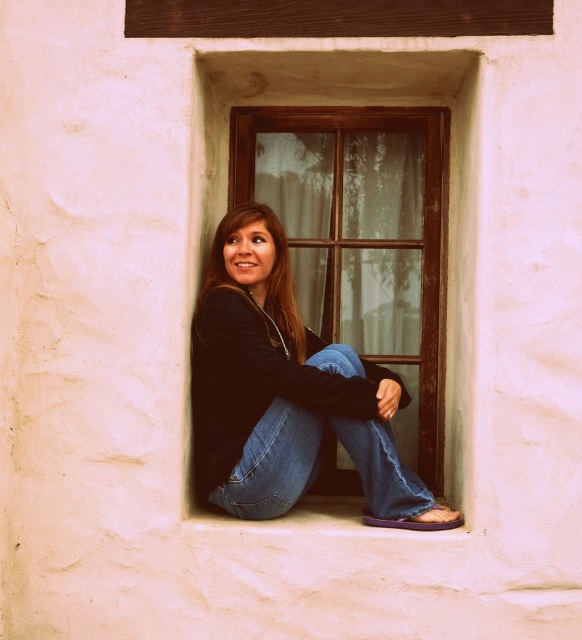
You are standing in the window alcove and want to place a small plant between the two points labeled point (207, 275) and point (278, 268). Based on their positions, which point should the plant be closer to in order to be nearer to the viewer?

The plant should be closer to point (207, 275) because it is further to the viewer than point (278, 268).

Based on the photo, you are a tailor who needs to determine which clothing item requires more fabric to repair between the jeans at center and the smooth black hoodie at center. Based on the scene, which one would need more fabric?

The jeans at center is larger in size than the smooth black hoodie at center, so the jeans at center would require more fabric for repairs.